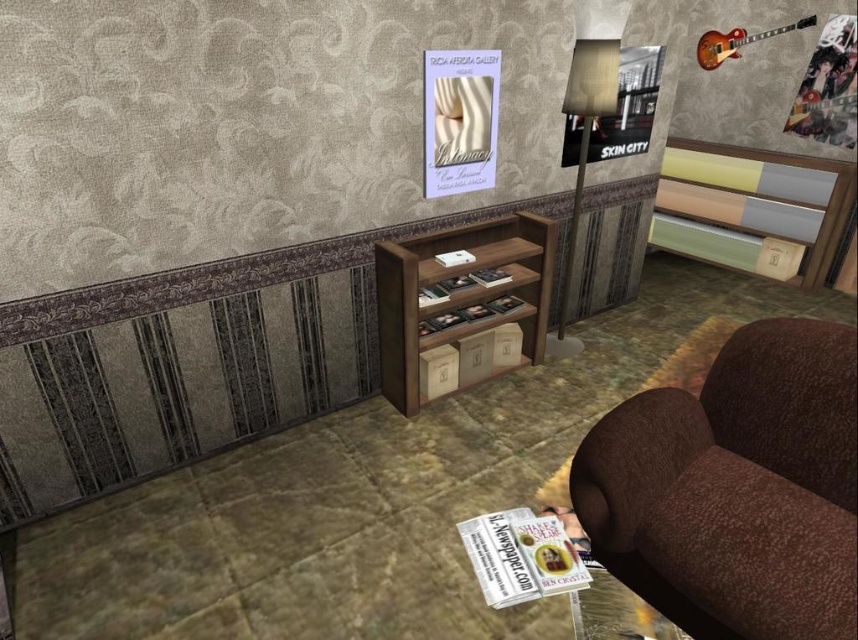
You are sitting in the brown textured armchair at lower right and want to reach the remote control placed on the brown wood entertainment center at center. Can you easily reach it without getting up?

The brown textured armchair at lower right is below the brown wood entertainment center at center, so the entertainment center is at a higher position. Depending on the armchair armrest height, you might need to stretch, but it might be reachable without getting up.